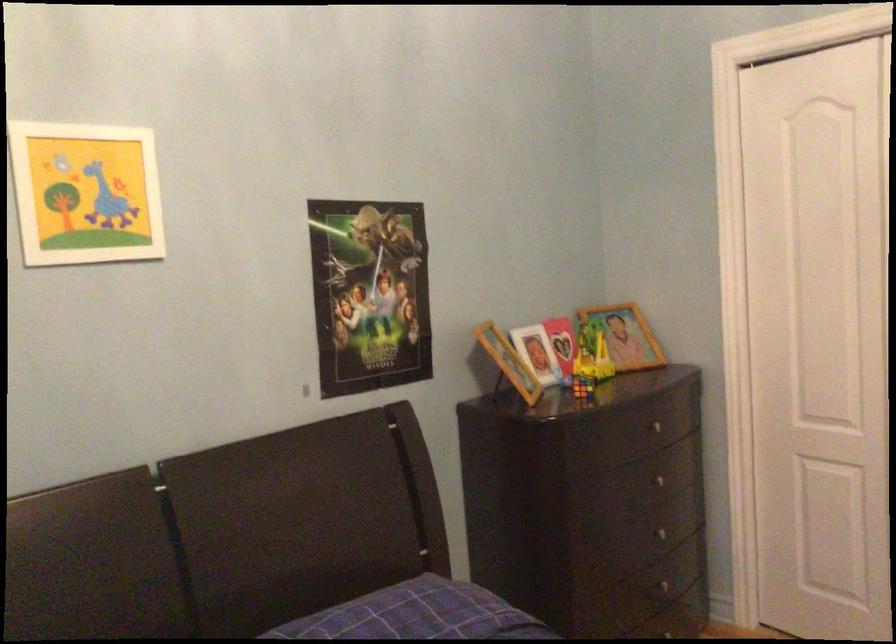
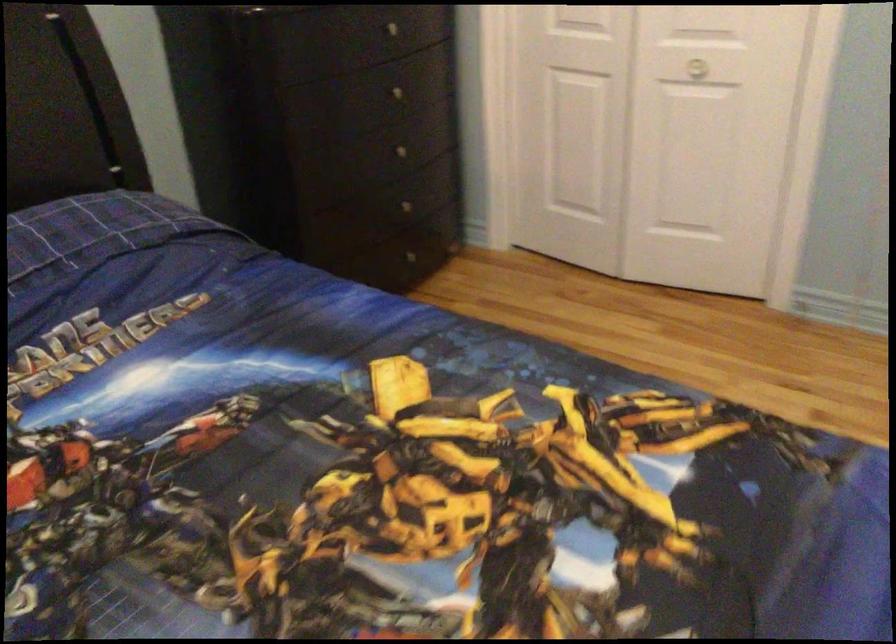
Question: How did the camera likely rotate?

Choices:
 (A) Left
 (B) Right
 (C) Up
 (D) Down

Answer: (D)